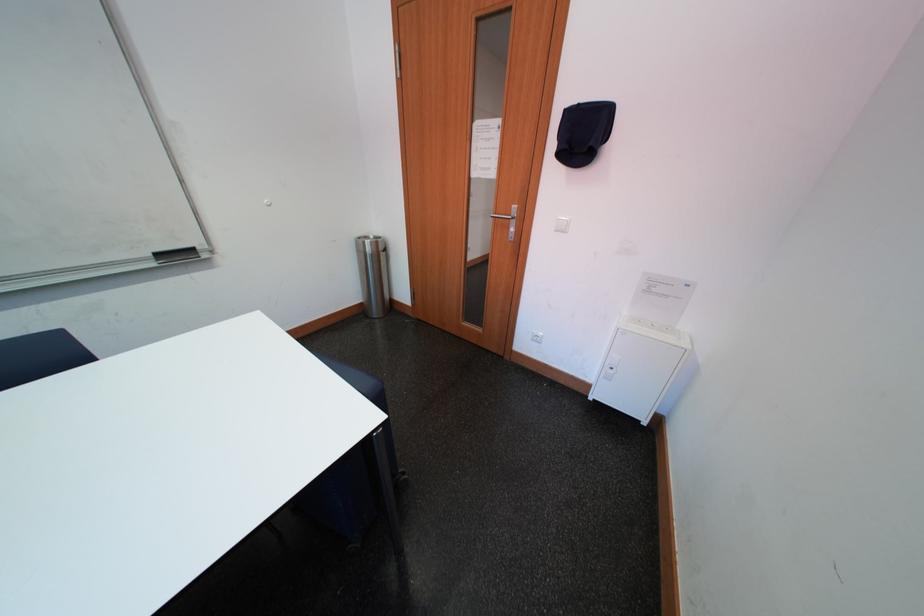
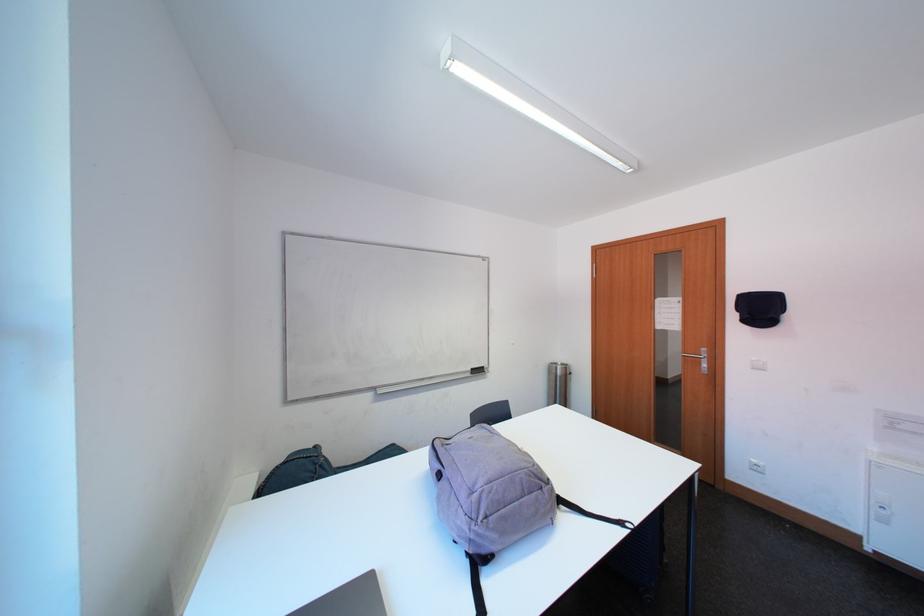
In the second image, find the point that corresponds to pixel 373 246 in the first image.

(565, 371)